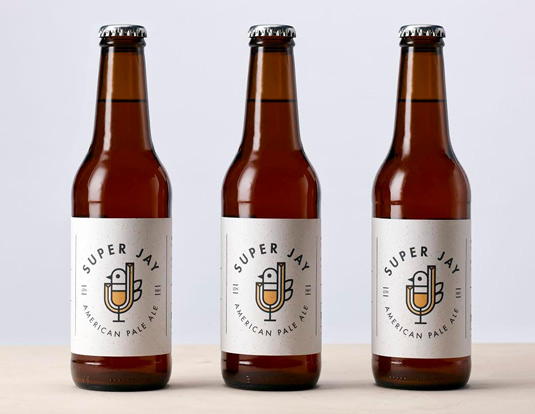
I want to click on brown table, so click(x=177, y=399).